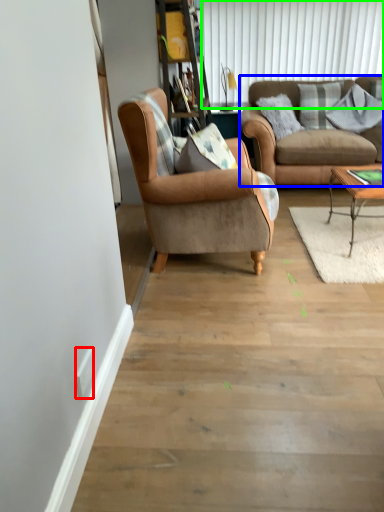
Question: Considering the real-world distances, which object is farthest from power outlet (highlighted by a red box)? studio couch (highlighted by a blue box) or shutter (highlighted by a green box)?

Choices:
 (A) studio couch
 (B) shutter

Answer: (B)